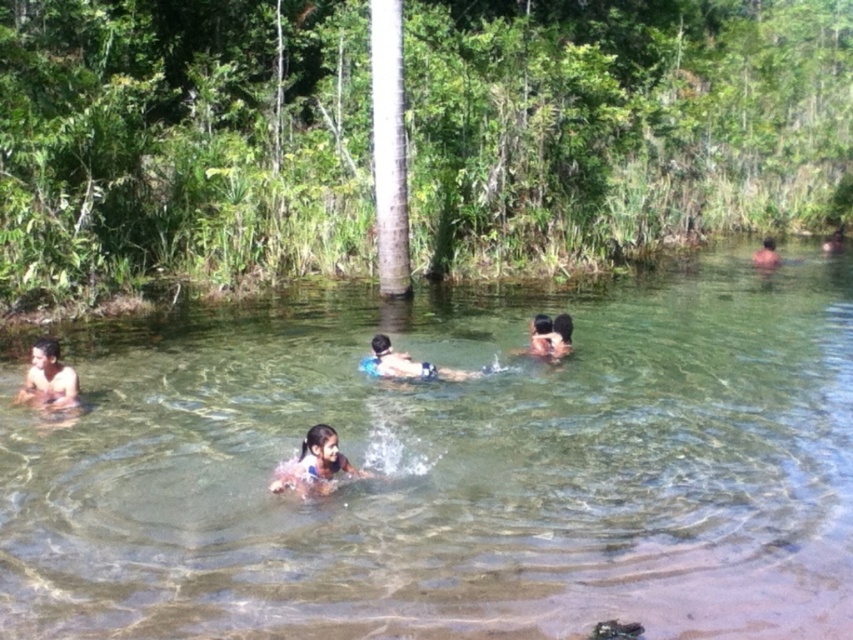
Question: Which point is farther from the camera taking this photo?

Choices:
 (A) coord(762,257)
 (B) coord(115,371)
 (C) coord(347,467)
 (D) coord(48,387)

Answer: (A)

Question: Can you confirm if clear water at center is wider than light brown skin at lower left?

Choices:
 (A) yes
 (B) no

Answer: (A)

Question: Is clear water at center to the right of light brown skin at lower left from the viewer's perspective?

Choices:
 (A) no
 (B) yes

Answer: (B)

Question: Estimate the real-world distances between objects in this image. Which object is closer to the blue fabric at center?

Choices:
 (A) brown skin at upper right
 (B) light brown skin at lower left

Answer: (B)

Question: Which point is closer to the camera taking this photo?

Choices:
 (A) (556, 508)
 (B) (45, 406)
 (C) (341, 472)
 (D) (390, 371)

Answer: (A)

Question: Does clear water at center lie behind brown skin at center?

Choices:
 (A) yes
 (B) no

Answer: (B)